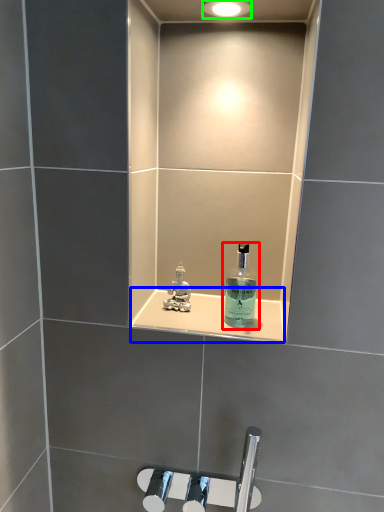
Question: Considering the real-world distances, which object is farthest from bottle (highlighted by a red box)? ledge (highlighted by a blue box) or light fixture (highlighted by a green box)?

Choices:
 (A) ledge
 (B) light fixture

Answer: (B)